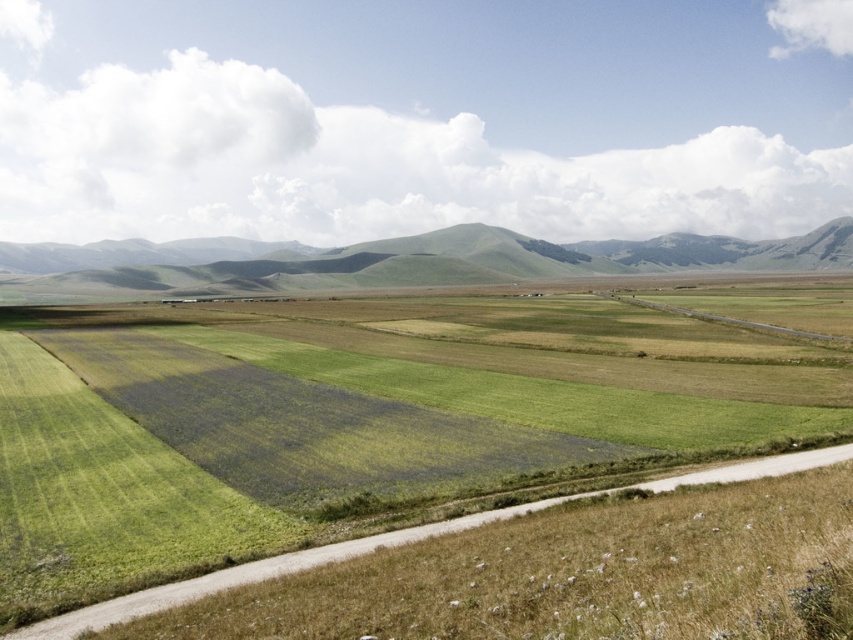
Question: Does green grassland at center appear on the right side of green grassy hill at center?

Choices:
 (A) yes
 (B) no

Answer: (B)

Question: Observing the image, what is the correct spatial positioning of green grassland at center in reference to green grassy hill at center?

Choices:
 (A) above
 (B) below

Answer: (B)

Question: Can you confirm if green grassland at center is thinner than green grassy hill at center?

Choices:
 (A) yes
 (B) no

Answer: (A)

Question: Which point is farther to the camera?

Choices:
 (A) green grassland at center
 (B) green grassy hill at center

Answer: (B)

Question: Which object is closer to the camera taking this photo?

Choices:
 (A) green grassy hill at center
 (B) green grassland at center

Answer: (B)